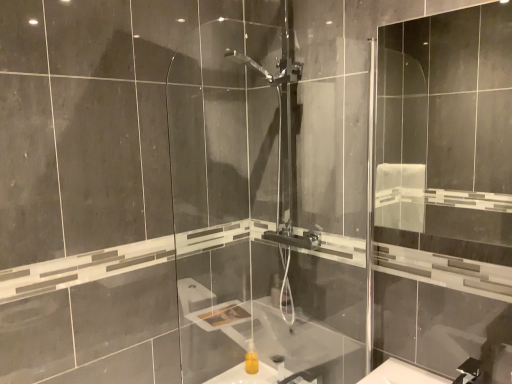
Question: Looking at the image, does yellow matte sink at center seem bigger or smaller compared to transparent glass screen door at right, the first screen door positioned from the right?

Choices:
 (A) big
 (B) small

Answer: (B)

Question: Do you think yellow matte sink at center is within transparent glass screen door at right, positioned as the second screen door in left-to-right order, or outside of it?

Choices:
 (A) outside
 (B) inside

Answer: (A)

Question: Which is nearer to the transparent glass screen door at right, positioned as the second screen door in left-to-right order?

Choices:
 (A) transparent glass shower door at center, which is the 2th screen door in right-to-left order
 (B) yellow matte sink at center

Answer: (A)

Question: Estimate the real-world distances between objects in this image. Which object is farther from the transparent glass shower door at center, the 1th screen door from the left?

Choices:
 (A) transparent glass screen door at right, the first screen door positioned from the right
 (B) yellow matte sink at center

Answer: (A)